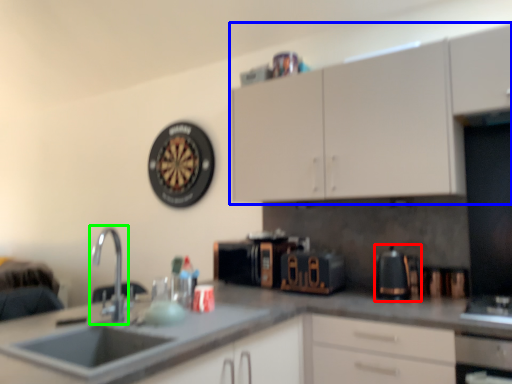
Question: Estimate the real-world distances between objects in this image. Which object is farther from coffeepot (highlighted by a red box), cabinetry (highlighted by a blue box) or tap (highlighted by a green box)?

Choices:
 (A) cabinetry
 (B) tap

Answer: (B)